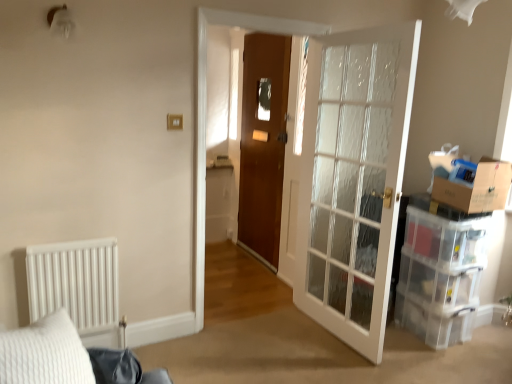
Identify the location of vacant space underneath wooden door at center (from a real-world perspective). The height and width of the screenshot is (384, 512). (253, 259).